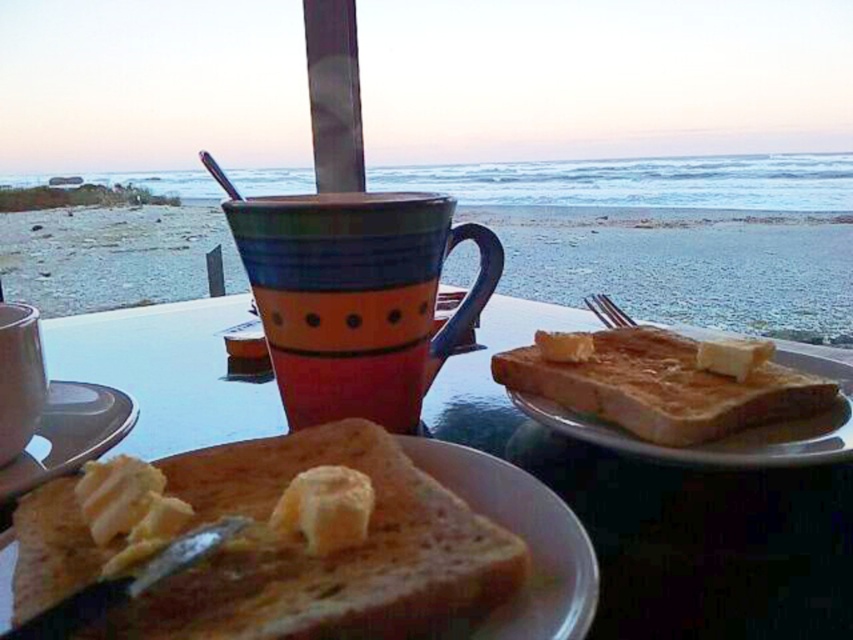
Question: Which point is closer to the camera taking this photo?

Choices:
 (A) (128, 451)
 (B) (756, 378)
 (C) (618, 228)

Answer: (B)

Question: Does golden brown toasted bread at lower left come behind matte ceramic mug at lower left?

Choices:
 (A) no
 (B) yes

Answer: (A)

Question: Is golden brown toasted bread at lower left to the right of matte ceramic mug at lower left from the viewer's perspective?

Choices:
 (A) yes
 (B) no

Answer: (A)

Question: Which of the following is the closest to the observer?

Choices:
 (A) (643, 481)
 (B) (381, 404)
 (C) (817, 392)
 (D) (30, 394)

Answer: (D)

Question: Can you confirm if golden brown toast at right is positioned above matte plastic butter at lower left?

Choices:
 (A) yes
 (B) no

Answer: (A)

Question: Among these objects, which one is farthest from the camera?

Choices:
 (A) matte ceramic plate at center
 (B) matte plastic butter at lower left

Answer: (B)